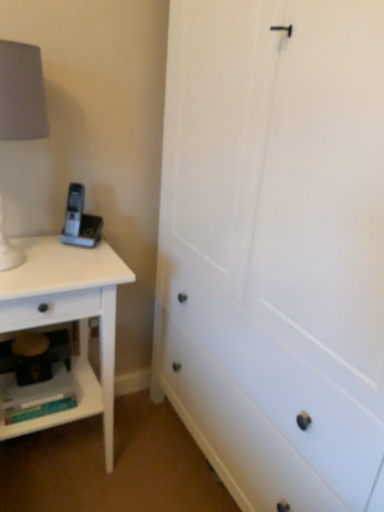
Image resolution: width=384 pixels, height=512 pixels. Find the location of `white matte nightstand at left`. white matte nightstand at left is located at coordinates (68, 319).

This screenshot has height=512, width=384. Describe the element at coordinates (68, 319) in the screenshot. I see `white matte nightstand at left` at that location.

The height and width of the screenshot is (512, 384). What are the coordinates of `white matte lampshade at left` in the screenshot? It's located at (22, 93).

Image resolution: width=384 pixels, height=512 pixels. Identify the location of white matte nightstand at left. (68, 319).

How many degrees apart are the facing directions of matte plastic shelf at lower left and white matte lampshade at left?

They differ by 1.13 degrees in their facing directions.

Is matte plastic shelf at lower left bigger than white matte lampshade at left?

Incorrect, matte plastic shelf at lower left is not larger than white matte lampshade at left.

Is matte plastic shelf at lower left aimed at white matte lampshade at left?

No.

Is matte plastic shelf at lower left in front of or behind white matte lampshade at left in the image?

In the image, matte plastic shelf at lower left appears behind white matte lampshade at left.

Does white matte lampshade at left turn towards white matte nightstand at left?

No, white matte lampshade at left is not turned towards white matte nightstand at left.

From the image's perspective, is white matte lampshade at left located above or below white matte nightstand at left?

white matte lampshade at left is above white matte nightstand at left.

Choose the correct answer: Is white matte lampshade at left inside white matte nightstand at left or outside it?

white matte lampshade at left is outside white matte nightstand at left.

Is white matte lampshade at left shorter than white matte nightstand at left?

Correct, white matte lampshade at left is not as tall as white matte nightstand at left.

Locate an element on the screen. This screenshot has height=512, width=384. shelf lying on the left of white matte lampshade at left is located at coordinates (64, 411).

Considering the relative positions of white matte lampshade at left and matte plastic shelf at lower left in the image provided, is white matte lampshade at left to the left or to the right of matte plastic shelf at lower left?

From the image, it's evident that white matte lampshade at left is to the right of matte plastic shelf at lower left.

Which point is more forward, (1, 137) or (83, 362)?

The point (1, 137) is more forward.

Measure the distance from white matte lampshade at left to matte plastic shelf at lower left.

A distance of 30.73 inches exists between white matte lampshade at left and matte plastic shelf at lower left.

Considering the relative sizes of matte plastic shelf at lower left and white matte chest of drawers at center in the image provided, is matte plastic shelf at lower left shorter than white matte chest of drawers at center?

Yes, matte plastic shelf at lower left is shorter than white matte chest of drawers at center.

How far apart are matte plastic shelf at lower left and white matte chest of drawers at center?

25.73 inches.

Are matte plastic shelf at lower left and white matte chest of drawers at center located far from each other?

No, matte plastic shelf at lower left is not far away from white matte chest of drawers at center.

Is matte plastic shelf at lower left not within white matte chest of drawers at center?

Absolutely, matte plastic shelf at lower left is external to white matte chest of drawers at center.

This screenshot has height=512, width=384. Find the location of `shelf below the white matte nightstand at left (from a real-world perspective)`. shelf below the white matte nightstand at left (from a real-world perspective) is located at coordinates (64, 411).

From the picture: Is matte plastic shelf at lower left positioned behind white matte nightstand at left?

Yes, matte plastic shelf at lower left is further from the viewer.

Consider the image. Does matte plastic shelf at lower left have a lesser height compared to white matte nightstand at left?

Indeed, matte plastic shelf at lower left has a lesser height compared to white matte nightstand at left.

Looking at this image, considering the relative sizes of matte plastic shelf at lower left and white matte nightstand at left in the image provided, is matte plastic shelf at lower left bigger than white matte nightstand at left?

Incorrect, matte plastic shelf at lower left is not larger than white matte nightstand at left.

From the image's perspective, between white matte chest of drawers at center and matte plastic shelf at lower left, which one is located above?

white matte chest of drawers at center appears higher in the image.

Is white matte chest of drawers at center smaller than matte plastic shelf at lower left?

Incorrect, white matte chest of drawers at center is not smaller in size than matte plastic shelf at lower left.

Is white matte chest of drawers at center with matte plastic shelf at lower left?

No, white matte chest of drawers at center is not touching matte plastic shelf at lower left.

Is white matte chest of drawers at center at the right side of matte plastic shelf at lower left?

Yes, white matte chest of drawers at center is to the right of matte plastic shelf at lower left.

Considering the sizes of white matte chest of drawers at center and white matte nightstand at left in the image, is white matte chest of drawers at center taller or shorter than white matte nightstand at left?

Clearly, white matte chest of drawers at center is taller compared to white matte nightstand at left.

How many degrees apart are the facing directions of white matte chest of drawers at center and white matte nightstand at left?

They differ by 90.1 degrees in their facing directions.

Does white matte chest of drawers at center turn towards white matte nightstand at left?

Yes, white matte chest of drawers at center is facing white matte nightstand at left.

The image size is (384, 512). What are the coordinates of `the chest of drawers in front of the white matte nightstand at left` in the screenshot? It's located at (275, 247).

Locate an element on the screen. This screenshot has width=384, height=512. table lamp above the matte plastic shelf at lower left (from the image's perspective) is located at coordinates (22, 93).

This screenshot has width=384, height=512. I want to click on nightstand below the white matte lampshade at left (from the image's perspective), so click(68, 319).

When comparing their distances from matte plastic shelf at lower left, does white matte nightstand at left or white matte chest of drawers at center seem further?

white matte chest of drawers at center lies further to matte plastic shelf at lower left than the other object.

When comparing their distances from white matte lampshade at left, does white matte nightstand at left or white matte chest of drawers at center seem closer?

The object closer to white matte lampshade at left is white matte nightstand at left.

Which object lies further to the anchor point white matte chest of drawers at center, white matte lampshade at left or matte plastic shelf at lower left?

matte plastic shelf at lower left is positioned further to the anchor white matte chest of drawers at center.

Based on their spatial positions, is white matte chest of drawers at center or white matte lampshade at left closer to white matte nightstand at left?

The object closer to white matte nightstand at left is white matte chest of drawers at center.

From the image, which object appears to be nearer to matte plastic shelf at lower left, white matte chest of drawers at center or white matte lampshade at left?

white matte chest of drawers at center is positioned closer to the anchor matte plastic shelf at lower left.

Looking at the image, which one is located further to white matte chest of drawers at center, matte plastic shelf at lower left or white matte nightstand at left?

matte plastic shelf at lower left is further to white matte chest of drawers at center.

Considering their positions, is white matte nightstand at left positioned closer to white matte chest of drawers at center than white matte lampshade at left?

Based on the image, white matte nightstand at left appears to be nearer to white matte chest of drawers at center.

Estimate the real-world distances between objects in this image. Which object is further from white matte nightstand at left, white matte lampshade at left or matte plastic shelf at lower left?

white matte lampshade at left lies further to white matte nightstand at left than the other object.

Locate an element on the screen. Image resolution: width=384 pixels, height=512 pixels. table lamp situated between white matte nightstand at left and white matte chest of drawers at center from left to right is located at coordinates (22, 93).

The width and height of the screenshot is (384, 512). I want to click on table lamp between matte plastic shelf at lower left and white matte chest of drawers at center from left to right, so click(22, 93).

Where is `nightstand between white matte lampshade at left and matte plastic shelf at lower left in the vertical direction`? The image size is (384, 512). nightstand between white matte lampshade at left and matte plastic shelf at lower left in the vertical direction is located at coordinates [x=68, y=319].

Locate an element on the screen. nightstand situated between matte plastic shelf at lower left and white matte chest of drawers at center from left to right is located at coordinates (68, 319).